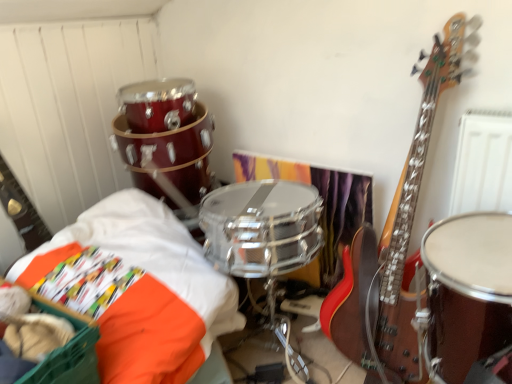
Question: Considering the positions of point tap(450, 322) and point tap(94, 352), is point tap(450, 322) closer or farther from the camera than point tap(94, 352)?

Choices:
 (A) farther
 (B) closer

Answer: (A)

Question: Do you think shiny brown drum at right is within orange fabric basket at lower left, or outside of it?

Choices:
 (A) inside
 (B) outside

Answer: (B)

Question: Which of these objects is positioned closest to the orange fabric basket at lower left?

Choices:
 (A) orange fabric at lower left
 (B) shiny brown drum at right

Answer: (A)

Question: Estimate the real-world distances between objects in this image. Which object is closer to the shiny brown drum at right?

Choices:
 (A) orange fabric basket at lower left
 (B) orange fabric at lower left

Answer: (B)